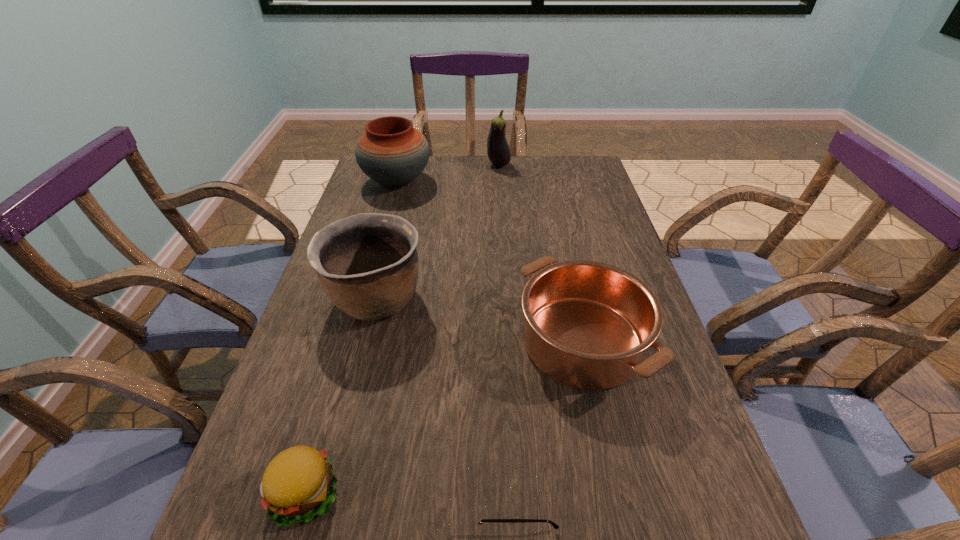
You are a GUI agent. You are given a task and a screenshot of the screen. Output one action in this format:
    pyautogui.click(x=<x>, y=<y>)
    Task: Click on the eggplant that is positioned at the far edge
    Image resolution: width=960 pixels, height=540 pixels.
    Given the screenshot: What is the action you would take?
    pyautogui.click(x=498, y=150)

Where is `pottery situated at the far edge`? pottery situated at the far edge is located at coordinates (392, 152).

Where is `hamburger that is at the left edge`? This screenshot has height=540, width=960. hamburger that is at the left edge is located at coordinates (299, 482).

Image resolution: width=960 pixels, height=540 pixels. Identify the location of object at the right edge. (588, 324).

I want to click on object that is at the far left corner, so click(x=392, y=152).

Where is `vacant area at the far edge of the desktop`? This screenshot has width=960, height=540. vacant area at the far edge of the desktop is located at coordinates (x=467, y=173).

The image size is (960, 540). In order to click on vacant space at the left edge of the desktop in this screenshot , I will do `click(373, 204)`.

Identify the location of free space at the right edge of the desktop. (654, 534).

In the image, there is a desktop. Where is `vacant space at the far right corner`? This screenshot has height=540, width=960. vacant space at the far right corner is located at coordinates (585, 178).

You are a GUI agent. You are given a task and a screenshot of the screen. Output one action in this format:
    pyautogui.click(x=<x>, y=<y>)
    Task: Click on the free space between the eggplant and the hamburger
    
    Given the screenshot: What is the action you would take?
    pyautogui.click(x=401, y=329)